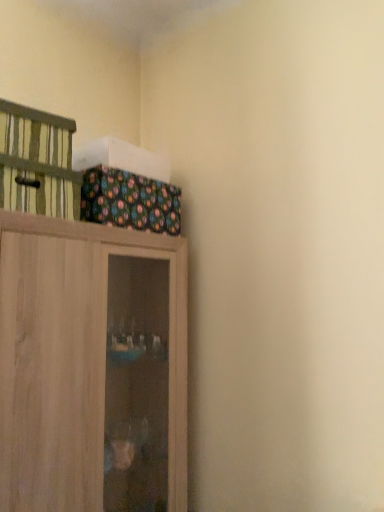
Describe the element at coordinates (37, 162) in the screenshot. The width and height of the screenshot is (384, 512). I see `green striped cabinet at upper left` at that location.

Image resolution: width=384 pixels, height=512 pixels. In order to click on green striped cabinet at upper left in this screenshot , I will do `click(37, 162)`.

Identify the location of wooden cupboard at upper left. (91, 367).

Measure the distance between wooden cupboard at upper left and camera.

wooden cupboard at upper left and camera are 4.06 feet apart.

What do you see at coordinates (91, 367) in the screenshot?
I see `wooden cupboard at upper left` at bounding box center [91, 367].

You are a GUI agent. You are given a task and a screenshot of the screen. Output one action in this format:
    pyautogui.click(x=<x>, y=<y>)
    Task: Click on the green striped cabinet at upper left
    The image size is (384, 512).
    Given the screenshot: What is the action you would take?
    pyautogui.click(x=37, y=162)

Visually, is green striped cabinet at upper left positioned to the left or to the right of wooden cupboard at upper left?

green striped cabinet at upper left is positioned on wooden cupboard at upper left's left side.

Considering the positions of objects green striped cabinet at upper left and wooden cupboard at upper left in the image provided, who is in front, green striped cabinet at upper left or wooden cupboard at upper left?

Positioned in front is wooden cupboard at upper left.

Is point (64, 177) closer to viewer compared to point (77, 284)?

No, (64, 177) is further to viewer.

From the image's perspective, is green striped cabinet at upper left above wooden cupboard at upper left?

Yes, from the image's perspective, green striped cabinet at upper left is over wooden cupboard at upper left.

From a real-world perspective, is green striped cabinet at upper left above or below wooden cupboard at upper left?

From a real-world perspective, green striped cabinet at upper left is physically above wooden cupboard at upper left.

Considering the sizes of objects green striped cabinet at upper left and wooden cupboard at upper left in the image provided, who is thinner, green striped cabinet at upper left or wooden cupboard at upper left?

green striped cabinet at upper left is thinner.

Is green striped cabinet at upper left taller or shorter than wooden cupboard at upper left?

green striped cabinet at upper left is shorter than wooden cupboard at upper left.

Considering the relative sizes of green striped cabinet at upper left and wooden cupboard at upper left in the image provided, is green striped cabinet at upper left smaller than wooden cupboard at upper left?

Yes.

Could wooden cupboard at upper left be considered to be inside green striped cabinet at upper left?

That's incorrect, wooden cupboard at upper left is not inside green striped cabinet at upper left.

Is green striped cabinet at upper left positioned far away from wooden cupboard at upper left?

That's not correct — green striped cabinet at upper left is a little close to wooden cupboard at upper left.

Is green striped cabinet at upper left oriented away from wooden cupboard at upper left?

That's not correct — green striped cabinet at upper left is not looking away from wooden cupboard at upper left.

How many degrees apart are the facing directions of green striped cabinet at upper left and wooden cupboard at upper left?

4.73 degrees.

In the image, there is a wooden cupboard at upper left. Where is `cabinetry above it (from the image's perspective)`? This screenshot has height=512, width=384. cabinetry above it (from the image's perspective) is located at coordinates (37, 162).

Is wooden cupboard at upper left at the right side of green striped cabinet at upper left?

Indeed, wooden cupboard at upper left is positioned on the right side of green striped cabinet at upper left.

Does wooden cupboard at upper left come in front of green striped cabinet at upper left?

Yes, wooden cupboard at upper left is closer to the viewer.

Which is behind, point (139, 306) or point (6, 128)?

The point (139, 306) is farther from the camera.

From the image's perspective, is wooden cupboard at upper left on top of green striped cabinet at upper left?

No.

From a real-world perspective, does wooden cupboard at upper left stand above green striped cabinet at upper left?

No, from a real-world perspective, wooden cupboard at upper left is not on top of green striped cabinet at upper left.

Can you confirm if wooden cupboard at upper left is thinner than green striped cabinet at upper left?

No.

Considering the sizes of wooden cupboard at upper left and green striped cabinet at upper left in the image, is wooden cupboard at upper left taller or shorter than green striped cabinet at upper left?

Considering their sizes, wooden cupboard at upper left has more height than green striped cabinet at upper left.

In terms of size, does wooden cupboard at upper left appear bigger or smaller than green striped cabinet at upper left?

Clearly, wooden cupboard at upper left is larger in size than green striped cabinet at upper left.

Is wooden cupboard at upper left completely or partially outside of green striped cabinet at upper left?

wooden cupboard at upper left lies outside green striped cabinet at upper left's area.

Is wooden cupboard at upper left not near green striped cabinet at upper left?

No, wooden cupboard at upper left is not far away from green striped cabinet at upper left.

In the scene shown: Is wooden cupboard at upper left turned away from green striped cabinet at upper left?

No.

What's the angular difference between wooden cupboard at upper left and green striped cabinet at upper left's facing directions?

There is a 4.73-degree angle between the facing directions of wooden cupboard at upper left and green striped cabinet at upper left.

Identify the location of cupboard below the green striped cabinet at upper left (from a real-world perspective). (91, 367).

Locate an element on the screen. cupboard that appears below the green striped cabinet at upper left (from a real-world perspective) is located at coordinates (91, 367).

Where is `cabinetry on the left of wooden cupboard at upper left`? The image size is (384, 512). cabinetry on the left of wooden cupboard at upper left is located at coordinates (37, 162).